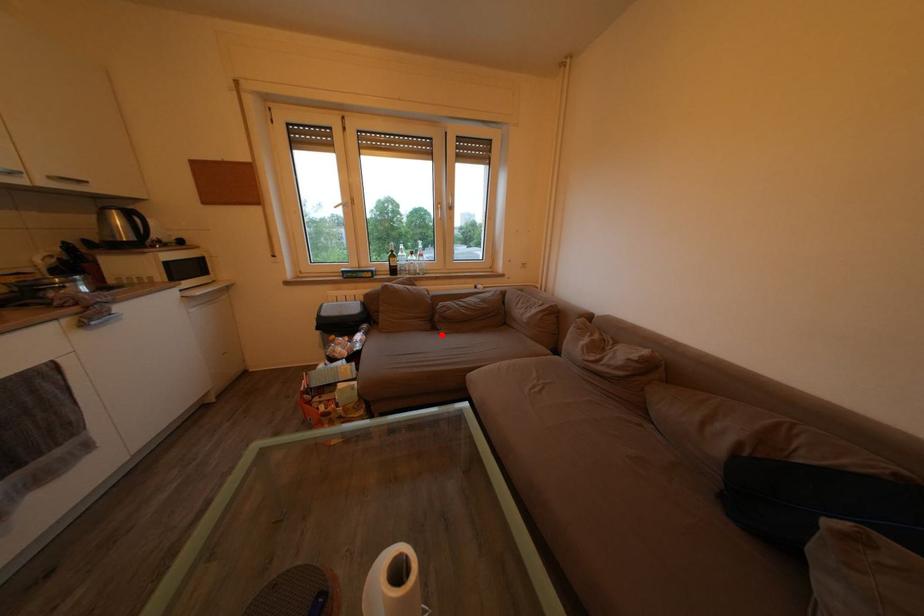
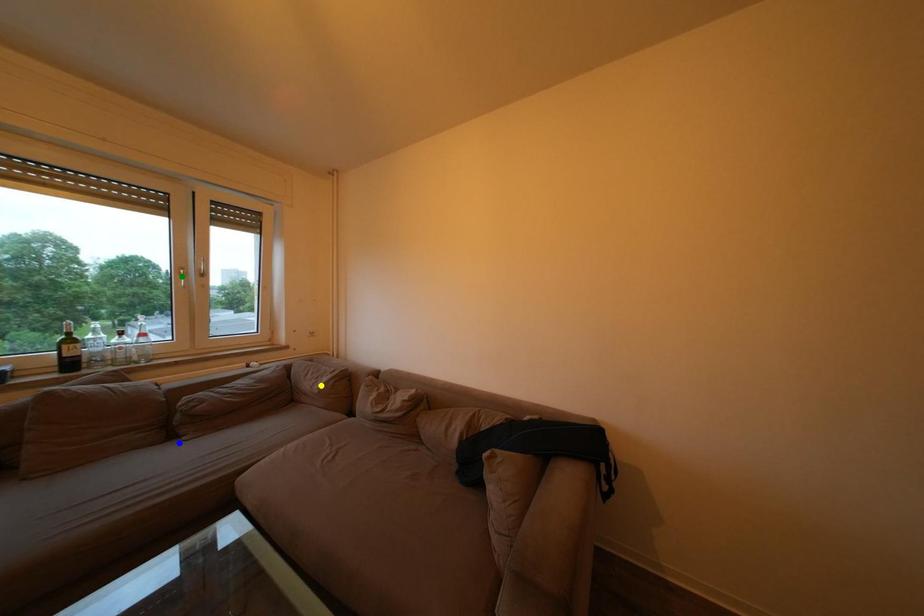
Question: I am providing you with two images of the same scene from different viewpoints. A red point is marked on the first image. You are given multiple points on the second image. In image 2, which mark is for the same physical point as the one in image 1?

Choices:
 (A) blue point
 (B) green point
 (C) yellow point

Answer: (A)